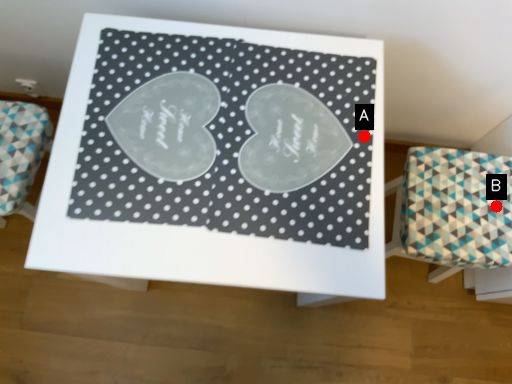
Question: Two points are circled on the image, labeled by A and B beside each circle. Which of the following is the closest to the observer?

Choices:
 (A) A is closer
 (B) B is closer

Answer: (A)